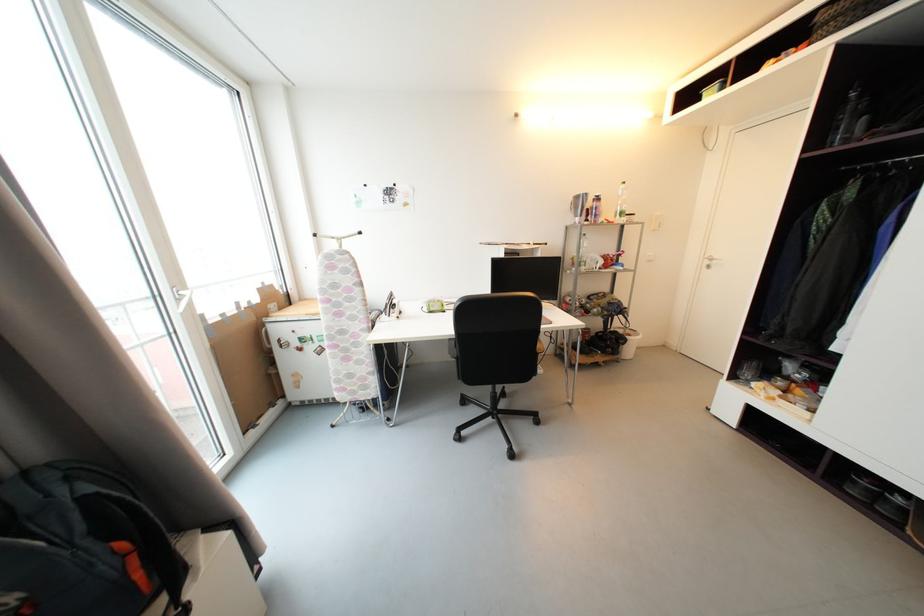
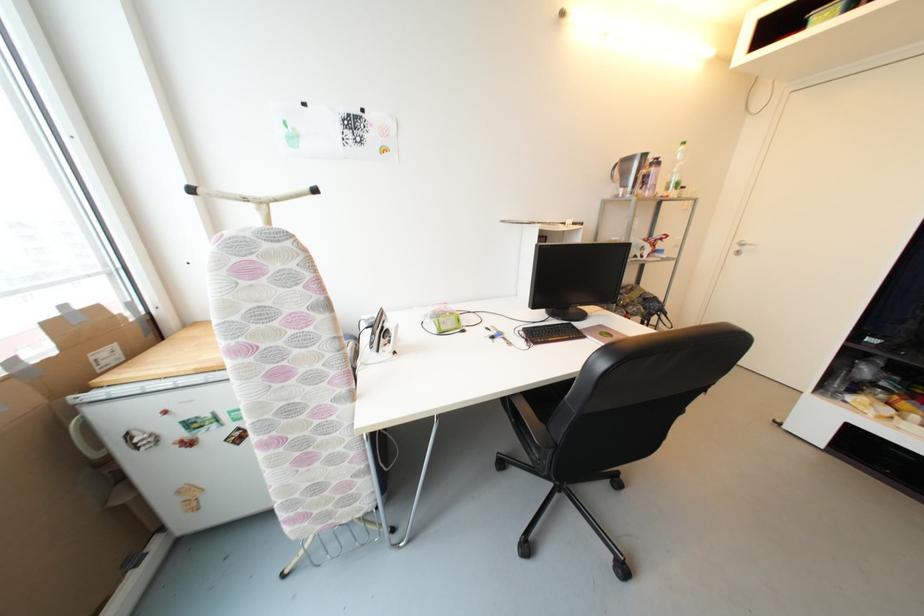
The point at (399,302) is marked in the first image. Where is the corresponding point in the second image?

(393, 328)